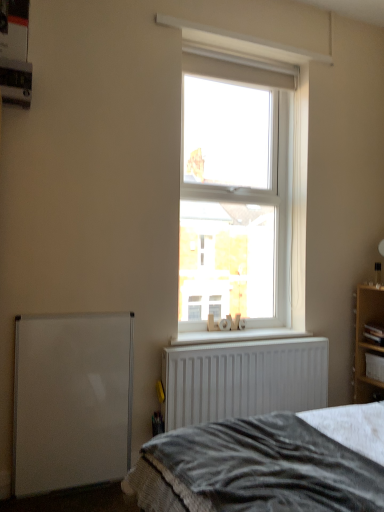
What is the approximate height of wooden cabinet at right?

wooden cabinet at right is 6.53 inches in height.

Measure the distance between point (373, 288) and camera.

2.84 meters.

What do you see at coordinates (267, 464) in the screenshot?
I see `textured gray blanket at lower center` at bounding box center [267, 464].

This screenshot has height=512, width=384. Describe the element at coordinates (235, 336) in the screenshot. I see `white textured wood at center` at that location.

Find the location of `wooden cabinet at right`. wooden cabinet at right is located at coordinates (365, 362).

Based on the photo, considering the relative positions of textured gray blanket at lower center and wooden shelf at right in the image provided, is textured gray blanket at lower center in front of wooden shelf at right?

That is True.

Between textured gray blanket at lower center and wooden shelf at right, which one appears on the left side from the viewer's perspective?

textured gray blanket at lower center is more to the left.

What are the coordinates of `bed that appears on the left of wooden shelf at right` in the screenshot? It's located at pyautogui.click(x=267, y=464).

Are textured gray blanket at lower center and wooden shelf at right located far from each other?

textured gray blanket at lower center is positioned a significant distance from wooden shelf at right.

Does clear glass window at center have a larger size compared to white matte whiteboard at lower left?

Correct, clear glass window at center is larger in size than white matte whiteboard at lower left.

Would you say clear glass window at center contains white matte whiteboard at lower left?

No, white matte whiteboard at lower left is not surrounded by clear glass window at center.

Considering the relative positions of clear glass window at center and white matte whiteboard at lower left in the image provided, is clear glass window at center to the right of white matte whiteboard at lower left from the viewer's perspective?

Correct, you'll find clear glass window at center to the right of white matte whiteboard at lower left.

Is clear glass window at center next to white matte whiteboard at lower left?

clear glass window at center and white matte whiteboard at lower left are not in contact.

Based on the photo, which of these two, wooden cabinet at right or textured gray blanket at lower center, stands shorter?

wooden cabinet at right.

Which of these two, wooden cabinet at right or textured gray blanket at lower center, is thinner?

Thinner between the two is wooden cabinet at right.

At what (x,y) coordinates should I click in order to perform the action: click on bed lying in front of the wooden cabinet at right. Please return your answer as a coordinate pair (x, y). This screenshot has width=384, height=512. Looking at the image, I should click on (267, 464).

Is wooden cabinet at right beside textured gray blanket at lower center?

No, wooden cabinet at right is not in contact with textured gray blanket at lower center.

From a real-world perspective, is white matte whiteboard at lower left positioned above or below wooden shelf at right?

In terms of real-world spatial position, white matte whiteboard at lower left is below wooden shelf at right.

Who is bigger, white matte whiteboard at lower left or wooden shelf at right?

wooden shelf at right.

Is white matte whiteboard at lower left positioned far away from wooden shelf at right?

Yes, white matte whiteboard at lower left and wooden shelf at right are quite far apart.

Is wooden shelf at right at the back of white matte whiteboard at lower left?

That's not correct — white matte whiteboard at lower left is not looking away from wooden shelf at right.

Which object is thinner, clear glass window at center or wooden cabinet at right?

With smaller width is clear glass window at center.

Is point (218, 212) behind point (382, 348)?

Yes.

Are clear glass window at center and wooden cabinet at right beside each other?

They are not placed beside each other.

In the image, there is a clear glass window at center. Find the location of `cabinet below it (from a real-world perspective)`. cabinet below it (from a real-world perspective) is located at coordinates (365, 362).

In the image, is white textured wood at center on the left side or the right side of clear glass window at center?

white textured wood at center is positioned on clear glass window at center's left side.

Could clear glass window at center be considered to be inside white textured wood at center?

No, clear glass window at center is not surrounded by white textured wood at center.

From a real-world perspective, is white textured wood at center beneath clear glass window at center?

Yes, from a real-world perspective, white textured wood at center is below clear glass window at center.

Which of these two, textured gray blanket at lower center or white matte whiteboard at lower left, is wider?

textured gray blanket at lower center.

Is textured gray blanket at lower center bigger or smaller than white matte whiteboard at lower left?

In the image, textured gray blanket at lower center appears to be larger than white matte whiteboard at lower left.

How different are the orientations of textured gray blanket at lower center and white matte whiteboard at lower left in degrees?

textured gray blanket at lower center and white matte whiteboard at lower left are facing 91.7 degrees away from each other.

Where is `wide that is above the textured gray blanket at lower center (from a real-world perspective)`? The image size is (384, 512). wide that is above the textured gray blanket at lower center (from a real-world perspective) is located at coordinates (72, 401).

Locate an element on the screen. The image size is (384, 512). shelf above the textured gray blanket at lower center (from a real-world perspective) is located at coordinates click(x=367, y=342).

The height and width of the screenshot is (512, 384). What are the coordinates of `wide to the left of clear glass window at center` in the screenshot? It's located at (72, 401).

Estimate the real-world distances between objects in this image. Which object is closer to wooden cabinet at right, white matte whiteboard at lower left or textured gray blanket at lower center?

The object closer to wooden cabinet at right is textured gray blanket at lower center.

Estimate the real-world distances between objects in this image. Which object is closer to wooden cabinet at right, textured gray blanket at lower center or white matte whiteboard at lower left?

Based on the image, textured gray blanket at lower center appears to be nearer to wooden cabinet at right.

From the image, which object appears to be farther from wooden cabinet at right, white textured wood at center or white matte whiteboard at lower left?

Based on the image, white matte whiteboard at lower left appears to be further to wooden cabinet at right.

Estimate the real-world distances between objects in this image. Which object is closer to clear glass window at center, white textured wood at center or white matte whiteboard at lower left?

Based on the image, white textured wood at center appears to be nearer to clear glass window at center.

Considering their positions, is wooden shelf at right positioned closer to textured gray blanket at lower center than wooden cabinet at right?

wooden shelf at right is closer to textured gray blanket at lower center.

Estimate the real-world distances between objects in this image. Which object is further from textured gray blanket at lower center, wooden cabinet at right or clear glass window at center?

wooden cabinet at right.

Looking at the image, which one is located further to wooden cabinet at right, white matte whiteboard at lower left or white textured wood at center?

white matte whiteboard at lower left is positioned further to the anchor wooden cabinet at right.

Which object lies further to the anchor point white matte whiteboard at lower left, textured gray blanket at lower center or white textured wood at center?

Based on the image, textured gray blanket at lower center appears to be further to white matte whiteboard at lower left.

Find the location of a particular element. This screenshot has width=384, height=512. bed located between white matte whiteboard at lower left and wooden shelf at right in the left-right direction is located at coordinates (267, 464).

Locate an element on the screen. Image resolution: width=384 pixels, height=512 pixels. window sill between textured gray blanket at lower center and wooden shelf at right along the z-axis is located at coordinates (235, 336).

Locate an element on the screen. The width and height of the screenshot is (384, 512). window sill between clear glass window at center and white matte whiteboard at lower left in the up-down direction is located at coordinates (235, 336).

The image size is (384, 512). What are the coordinates of `shelf located between textured gray blanket at lower center and wooden cabinet at right in the depth direction` in the screenshot? It's located at (367, 342).